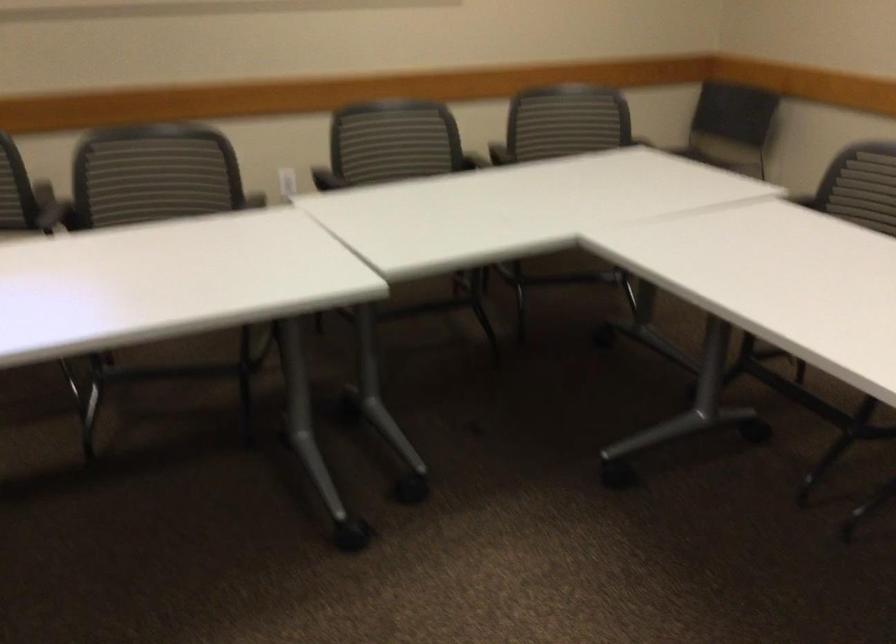
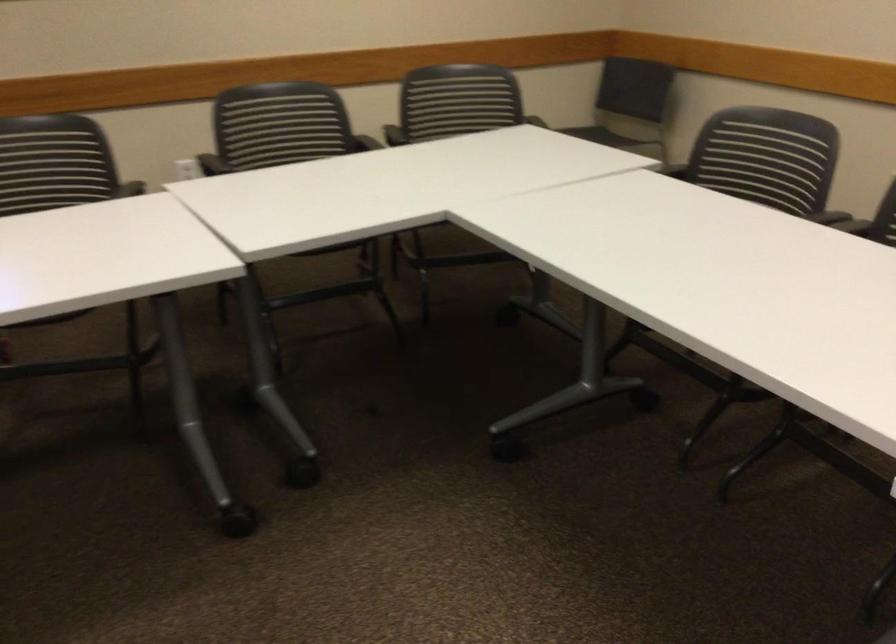
In the second image, find the point that corresponds to pixel 570 118 in the first image.

(455, 100)